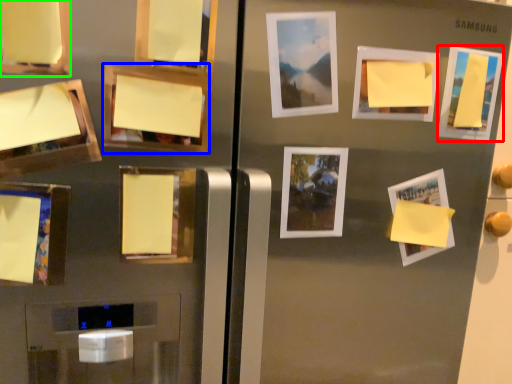
Question: Considering the real-world distances, which object is farthest from picture frame (highlighted by a red box)? picture frame (highlighted by a blue box) or picture frame (highlighted by a green box)?

Choices:
 (A) picture frame
 (B) picture frame

Answer: (B)